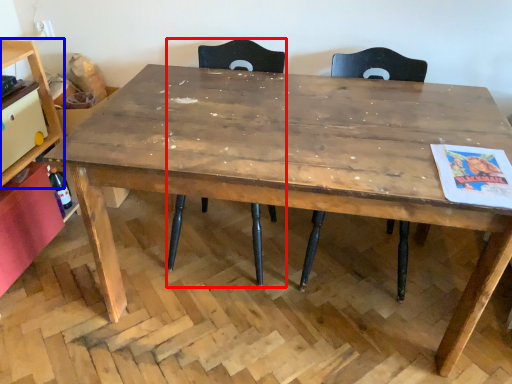
Question: Among these objects, which one is nearest to the camera, chair (highlighted by a red box) or shelf (highlighted by a blue box)?

Choices:
 (A) chair
 (B) shelf

Answer: (A)